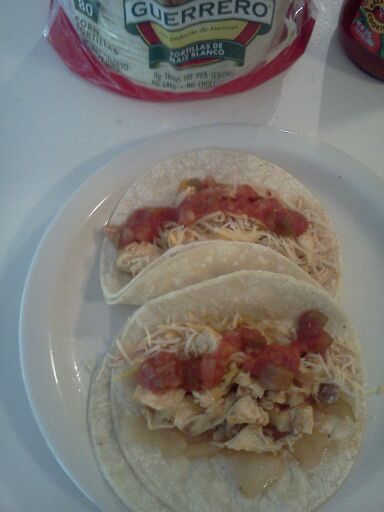
This screenshot has width=384, height=512. What are the coordinates of `table` in the screenshot? It's located at (28, 146).